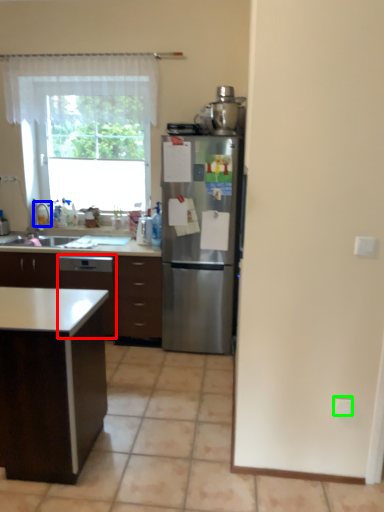
Question: Which object is the closest to the dish washer (highlighted by a red box)? Choose among these: faucet (highlighted by a blue box) or electric outlet (highlighted by a green box).

Choices:
 (A) faucet
 (B) electric outlet

Answer: (A)